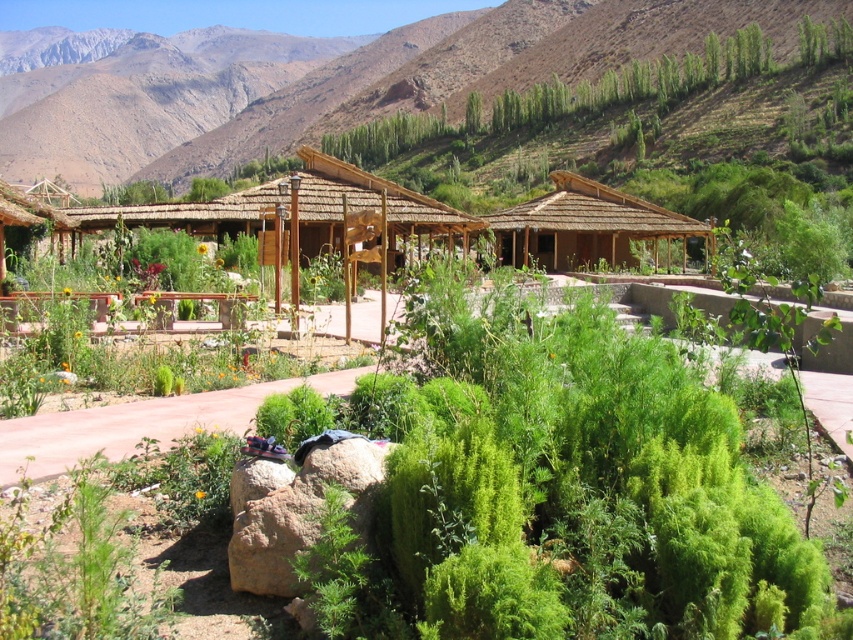
Which is more to the left, brown thatched hut at center or thatched straw hut at center?

thatched straw hut at center is more to the left.

Who is more forward, (585,193) or (248,202)?

Point (248,202) is more forward.

Between point (630, 198) and point (305, 186), which one is positioned in front?

Point (305, 186) is in front.

In order to click on brown thatched hut at center in this screenshot , I will do `click(585, 227)`.

Between brown thatched hut at center and brown rough boulder at lower center, which one is positioned higher?

brown thatched hut at center

Identify the location of brown thatched hut at center. (585, 227).

The height and width of the screenshot is (640, 853). In order to click on brown thatched hut at center in this screenshot , I will do `click(585, 227)`.

Based on the photo, between brown rough boulder at lower center and thatched straw hut at center, which one is positioned lower?

brown rough boulder at lower center

Describe the element at coordinates (300, 515) in the screenshot. I see `brown rough boulder at lower center` at that location.

Locate an element on the screen. The width and height of the screenshot is (853, 640). brown rough boulder at lower center is located at coordinates (300, 515).